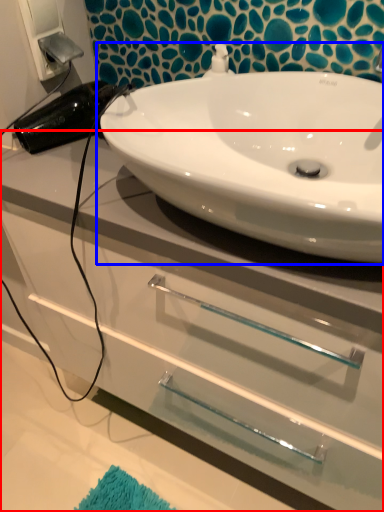
Question: Which of the following is the closest to the observer, bathroom cabinet (highlighted by a red box) or sink (highlighted by a blue box)?

Choices:
 (A) bathroom cabinet
 (B) sink

Answer: (B)